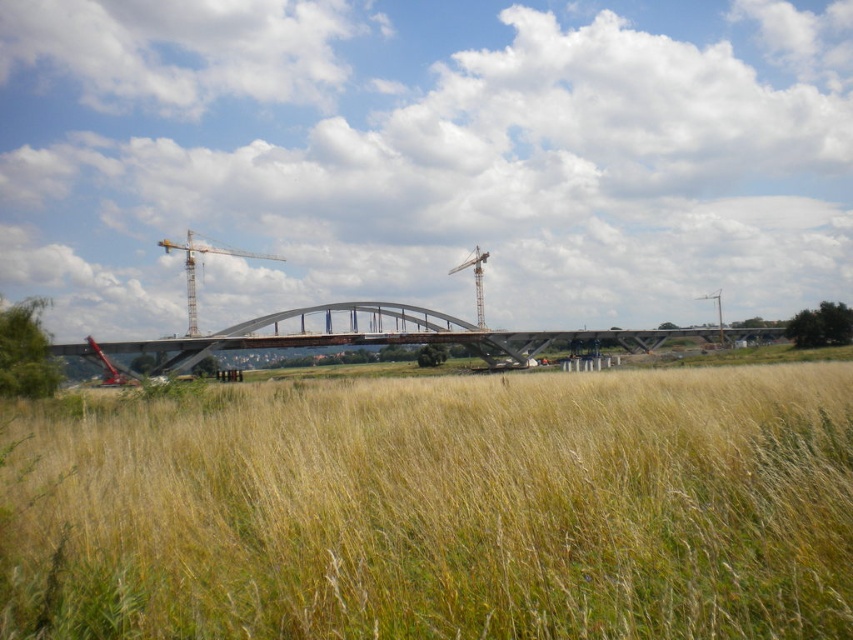
Can you confirm if concrete bridge at center is wider than metallic gray crane at upper center?

Yes.

Who is more distant from viewer, (165, 365) or (717, 305)?

The point (717, 305) is more distant.

Is point (538, 346) less distant than point (720, 333)?

Yes, it is.

This screenshot has height=640, width=853. Find the location of `concrete bridge at center`. concrete bridge at center is located at coordinates (389, 336).

Who is positioned more to the left, concrete bridge at center or metallic silver crane at center?

metallic silver crane at center is more to the left.

Between concrete bridge at center and metallic silver crane at center, which one has more height?

Standing taller between the two is metallic silver crane at center.

Is point (334, 323) in front of point (192, 323)?

Yes, point (334, 323) is in front of point (192, 323).

Locate an element on the screen. concrete bridge at center is located at coordinates (389, 336).

Is yellow grass at lower center smaller than metallic silver crane at center?

Yes.

Between point (679, 477) and point (242, 250), which one is positioned behind?

Positioned behind is point (242, 250).

Where is `yellow grass at lower center`? Image resolution: width=853 pixels, height=640 pixels. yellow grass at lower center is located at coordinates (445, 509).